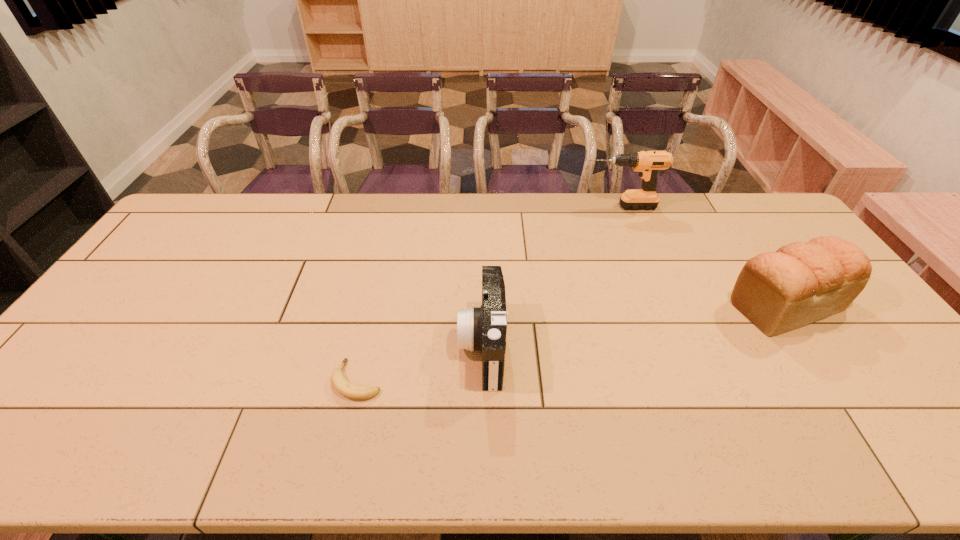
Find the location of a particular element. The image size is (960, 540). vacant space that satisfies the following two spatial constraints: 1. at the tip of the bread; 2. on the left side of the drill is located at coordinates (657, 303).

Image resolution: width=960 pixels, height=540 pixels. I want to click on vacant space that satisfies the following two spatial constraints: 1. at the tip of the second object from right to left; 2. on the back side of the rightmost object, so click(657, 303).